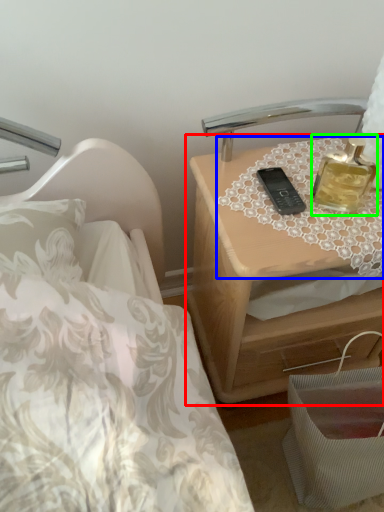
Question: Which is farther away from nightstand (highlighted by a red box)? tablecloth (highlighted by a blue box) or perfume (highlighted by a green box)?

Choices:
 (A) tablecloth
 (B) perfume

Answer: (B)